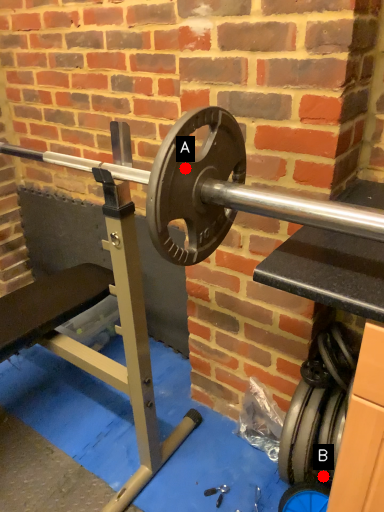
Question: Two points are circled on the image, labeled by A and B beside each circle. Which of the following is the farthest from the observer?

Choices:
 (A) A is further
 (B) B is further

Answer: (B)